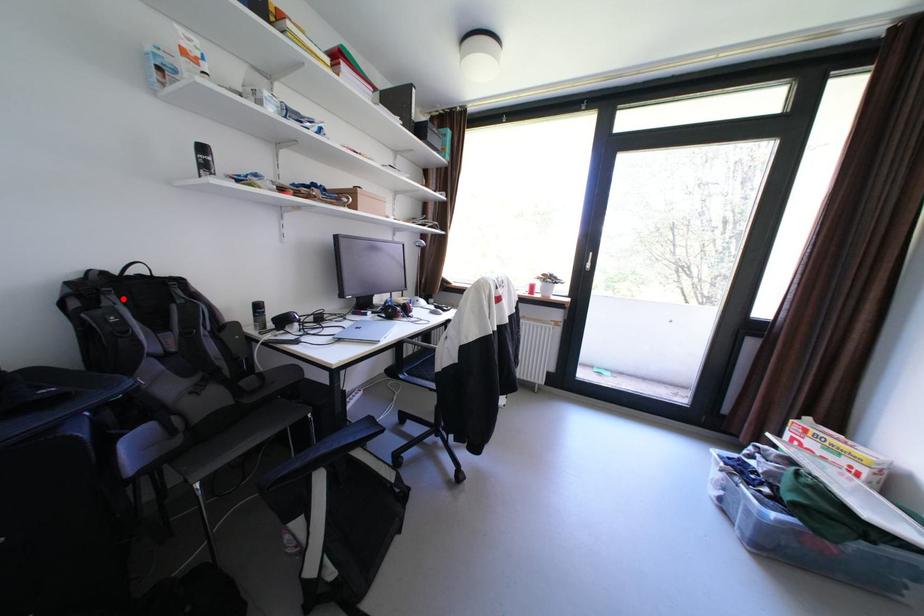
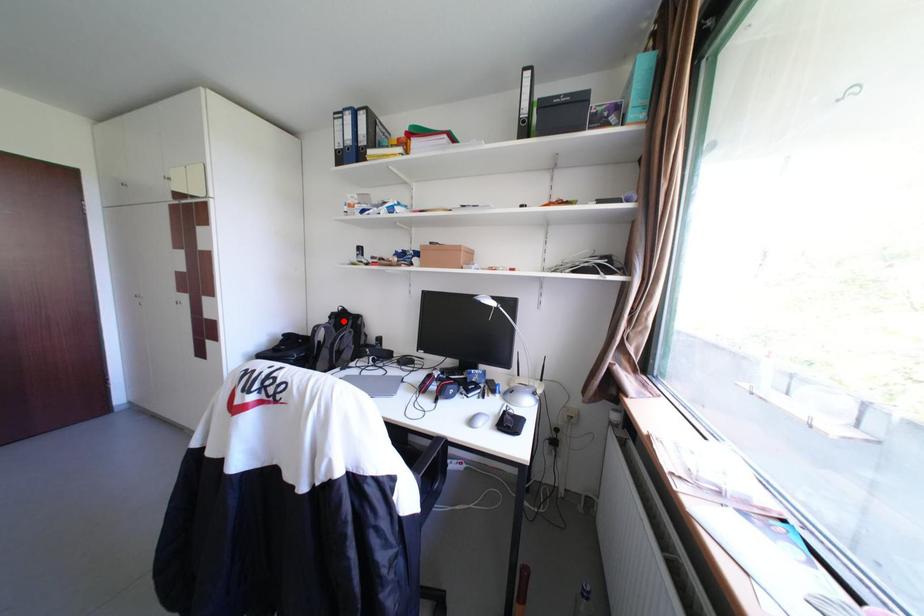
I am providing you with two images of the same scene from different viewpoints. A red point is marked on the first image and another point is marked on the second image. Does the point marked in image1 correspond to the same location as the one in image2?

Yes